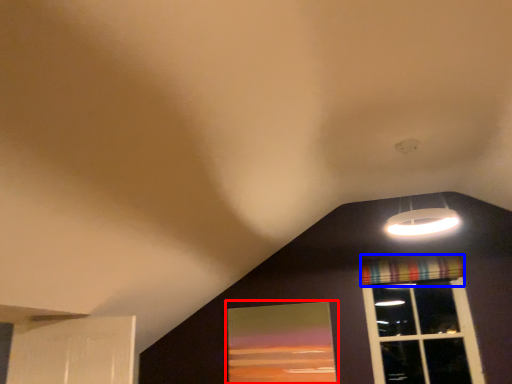
Question: Which of the following is the farthest to the observer, window screen (highlighted by a red box) or curtain (highlighted by a blue box)?

Choices:
 (A) window screen
 (B) curtain

Answer: (B)